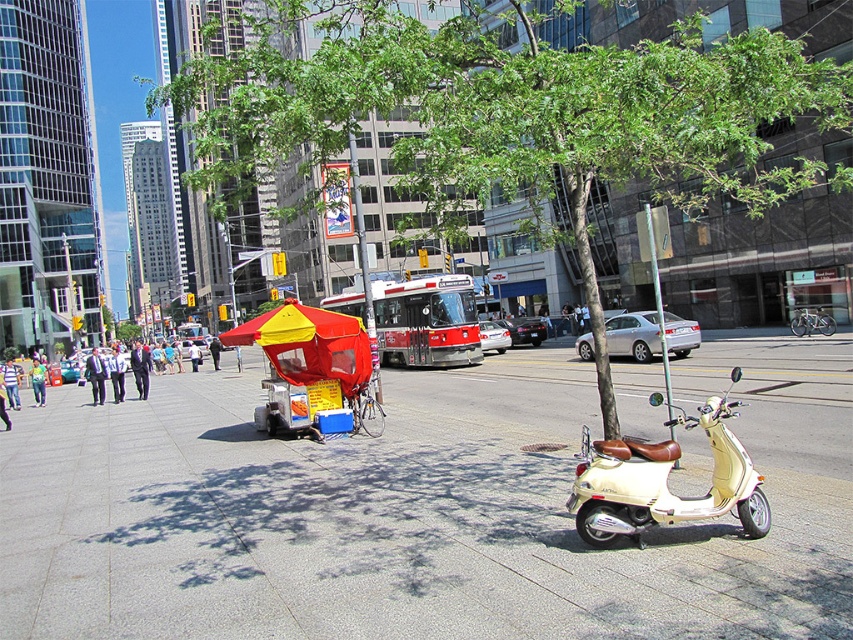
Question: Is smooth concrete sidewalk at center wider than green leafy tree at center?

Choices:
 (A) yes
 (B) no

Answer: (B)

Question: Observing the image, what is the correct spatial positioning of smooth concrete sidewalk at center in reference to green leafy tree at center?

Choices:
 (A) above
 (B) below

Answer: (B)

Question: Which object is the closest to the smooth concrete sidewalk at center?

Choices:
 (A) green leafy tree at center
 (B) red fabric umbrella at center
 (C) beige matte scooter at lower right

Answer: (C)

Question: Which object is the closest to the green leafy tree at center?

Choices:
 (A) beige matte scooter at lower right
 (B) red fabric umbrella at center

Answer: (B)

Question: Can you confirm if smooth concrete sidewalk at center is thinner than green leafy tree at center?

Choices:
 (A) yes
 (B) no

Answer: (A)

Question: Which point is closer to the camera?

Choices:
 (A) beige matte scooter at lower right
 (B) green leafy tree at center
 (C) smooth concrete sidewalk at center

Answer: (C)